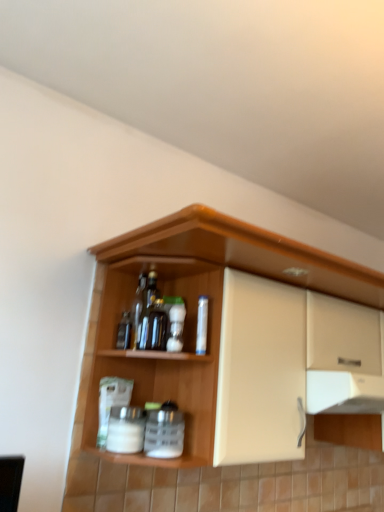
Question: Is white matte jar at lower center, arranged as the first beverage when viewed from the left, not within white plastic spice container at center, which is the 1th beverage in right-to-left order?

Choices:
 (A) no
 (B) yes

Answer: (B)

Question: Is white matte jar at lower center, positioned as the second beverage in right-to-left order, bigger than white plastic spice container at center, which is the second beverage in left-to-right order?

Choices:
 (A) yes
 (B) no

Answer: (B)

Question: Is white matte jar at lower center, positioned as the second beverage in right-to-left order, facing away from white plastic spice container at center, which is the second beverage in left-to-right order?

Choices:
 (A) no
 (B) yes

Answer: (A)

Question: From a real-world perspective, is white matte jar at lower center, positioned as the second beverage in right-to-left order, beneath white plastic spice container at center, which is the second beverage in left-to-right order?

Choices:
 (A) yes
 (B) no

Answer: (A)

Question: Can you confirm if white matte jar at lower center, positioned as the second beverage in right-to-left order, is wider than white plastic spice container at center, which is the second beverage in left-to-right order?

Choices:
 (A) yes
 (B) no

Answer: (B)

Question: Looking at the image, does white matte jar at lower center, arranged as the first beverage when viewed from the left, seem bigger or smaller compared to wooden cabinet at upper center?

Choices:
 (A) small
 (B) big

Answer: (A)

Question: Is point (119, 425) closer or farther from the camera than point (102, 260)?

Choices:
 (A) farther
 (B) closer

Answer: (B)

Question: Considering the relative positions of white matte jar at lower center, arranged as the first beverage when viewed from the left, and wooden cabinet at upper center in the image provided, is white matte jar at lower center, arranged as the first beverage when viewed from the left, to the left or to the right of wooden cabinet at upper center?

Choices:
 (A) right
 (B) left

Answer: (B)

Question: From their relative heights in the image, would you say white matte jar at lower center, positioned as the second beverage in right-to-left order, is taller or shorter than wooden cabinet at upper center?

Choices:
 (A) short
 (B) tall

Answer: (A)

Question: From a real-world perspective, is translucent glass bottle at center, the 1th bottle viewed from the left, above or below clear plastic bottle at center, the 2th bottle viewed from the left?

Choices:
 (A) below
 (B) above

Answer: (A)

Question: Relative to clear plastic bottle at center, the 1th bottle from the right, is translucent glass bottle at center, the 1th bottle viewed from the left, in front or behind?

Choices:
 (A) behind
 (B) front

Answer: (A)

Question: Is translucent glass bottle at center, acting as the 2th bottle starting from the right, inside or outside of clear plastic bottle at center, the 1th bottle from the right?

Choices:
 (A) inside
 (B) outside

Answer: (B)

Question: Considering the positions of point (182, 329) and point (205, 338), is point (182, 329) closer or farther from the camera than point (205, 338)?

Choices:
 (A) farther
 (B) closer

Answer: (A)

Question: From a real-world perspective, relative to wooden cabinet at upper center, is clear plastic bottle at center, the 1th bottle from the right, vertically above or below?

Choices:
 (A) below
 (B) above

Answer: (B)

Question: Considering the positions of clear plastic bottle at center, the 2th bottle viewed from the left, and wooden cabinet at upper center in the image, is clear plastic bottle at center, the 2th bottle viewed from the left, taller or shorter than wooden cabinet at upper center?

Choices:
 (A) tall
 (B) short

Answer: (B)